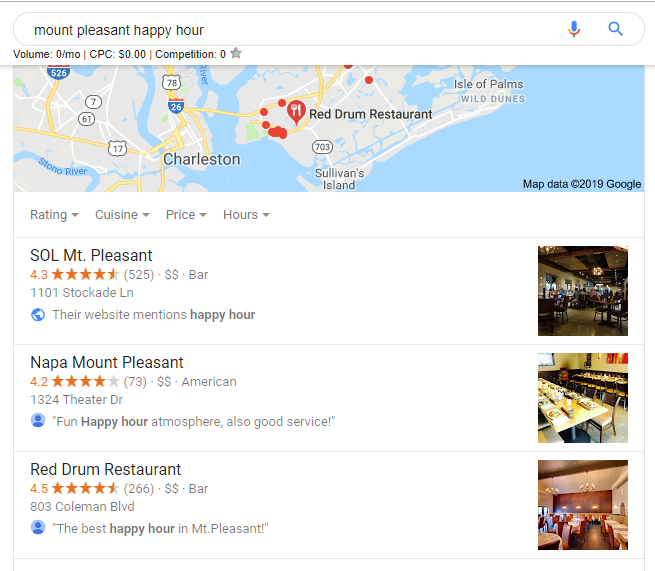
What are the coordinates of `wall` in the screenshot? It's located at (597, 364).